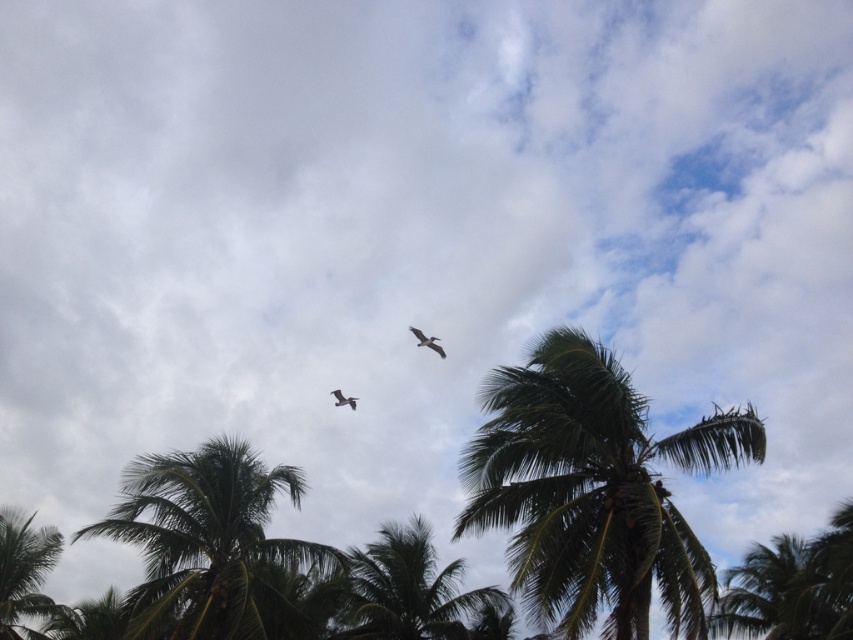
Between point (432, 349) and point (340, 394), which one is positioned in front?

Point (432, 349)

Which of these two, white matte bird at center or gray feathered bird at center, stands taller?

white matte bird at center

Between point (416, 342) and point (340, 392), which one is positioned behind?

The point (340, 392) is more distant.

Identify the location of white matte bird at center. (427, 340).

Can you confirm if green leafy coconut tree at center is smaller than dark green leafy coconut tree at lower left?

Indeed, green leafy coconut tree at center has a smaller size compared to dark green leafy coconut tree at lower left.

Can you confirm if green leafy coconut tree at center is shorter than dark green leafy coconut tree at lower left?

Incorrect, green leafy coconut tree at center's height does not fall short of dark green leafy coconut tree at lower left's.

Is point (573, 419) positioned before point (250, 632)?

Yes, it is in front of point (250, 632).

Locate an element on the screen. Image resolution: width=853 pixels, height=640 pixels. green leafy coconut tree at center is located at coordinates (593, 490).

Is point (354, 580) in front of point (9, 561)?

Yes, it is in front of point (9, 561).

Between green leafy palm tree at lower center and green leafy coconut tree at lower left, which one has more height?

Standing taller between the two is green leafy coconut tree at lower left.

Between point (439, 605) and point (0, 548), which one is positioned behind?

The point (0, 548) is more distant.

Locate an element on the screen. green leafy palm tree at lower center is located at coordinates (407, 589).